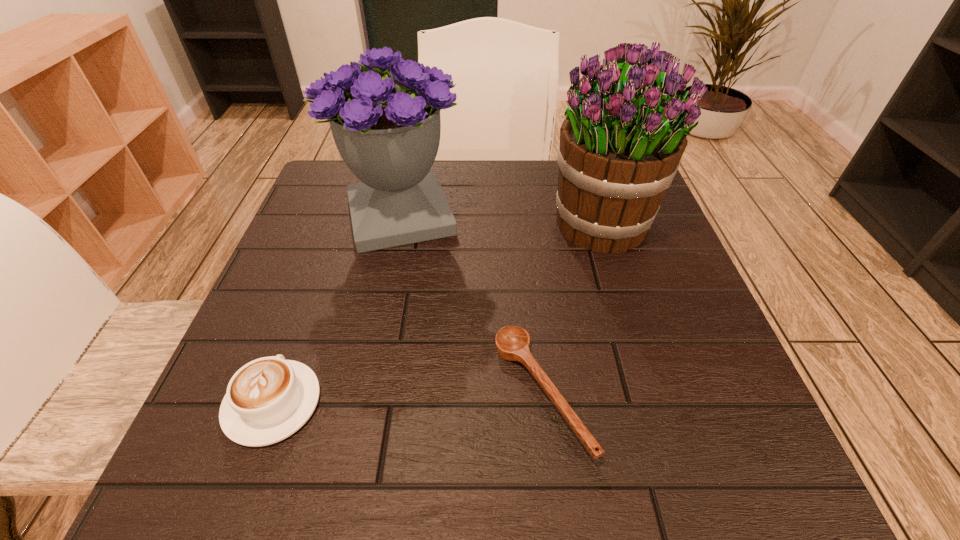
Locate an element on the screen. Image resolution: width=960 pixels, height=540 pixels. the right bouquet is located at coordinates (621, 143).

The width and height of the screenshot is (960, 540). I want to click on the left bouquet, so click(387, 130).

Image resolution: width=960 pixels, height=540 pixels. I want to click on the second shortest object, so click(267, 400).

The height and width of the screenshot is (540, 960). I want to click on the shortest object, so click(512, 342).

Image resolution: width=960 pixels, height=540 pixels. What are the coordinates of `vacant space situated 0.300m on the front of the right bouquet` in the screenshot? It's located at (660, 399).

At what (x,y) coordinates should I click in order to perform the action: click on free region located on the front of the left bouquet. Please return your answer as a coordinate pair (x, y). Looking at the image, I should click on (387, 279).

Find the location of `free space located with the handle on the right side of the cappuccino`. free space located with the handle on the right side of the cappuccino is located at coordinates (336, 228).

Where is `free space located 0.390m with the handle on the right side of the cappuccino`? The image size is (960, 540). free space located 0.390m with the handle on the right side of the cappuccino is located at coordinates (341, 218).

Find the location of a particular element. free space located with the handle on the right side of the cappuccino is located at coordinates (305, 312).

Locate an element on the screen. This screenshot has height=540, width=960. blank space located 0.340m on the back of the wooden spoon is located at coordinates (522, 215).